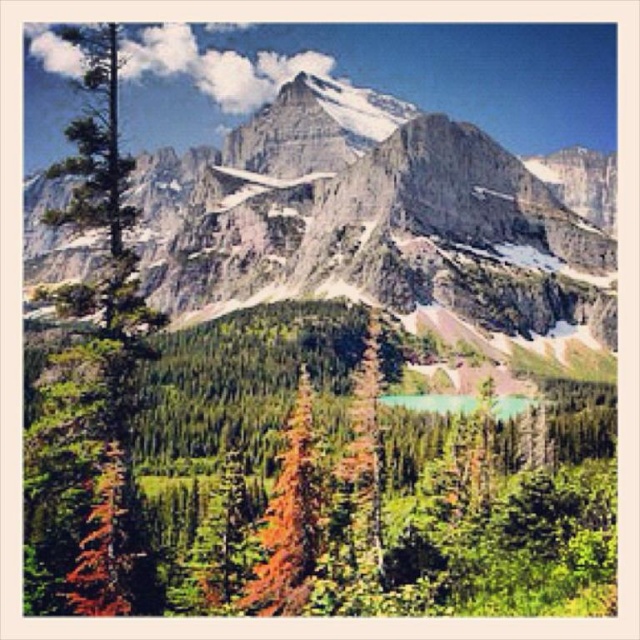
You are an environmental scientist assessing the health of this forest. You observe the green matte tree at left and the green matte tree at center. Which tree has a greater width, indicating better health?

The green matte tree at left has a greater width than the green matte tree at center, indicating better health.

You are standing at the center of the valley looking towards the mountains. There is a point marked at coordinates (92, 376). Which object in the scene does this point correspond to?

The point at coordinates (92, 376) is on the green matte tree at left.